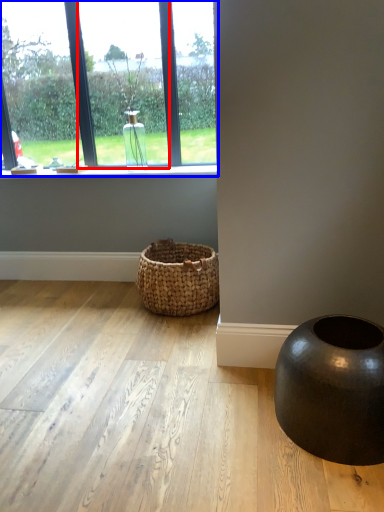
Question: Which point is closer to the camera, window (highlighted by a red box) or window (highlighted by a blue box)?

Choices:
 (A) window
 (B) window

Answer: (A)